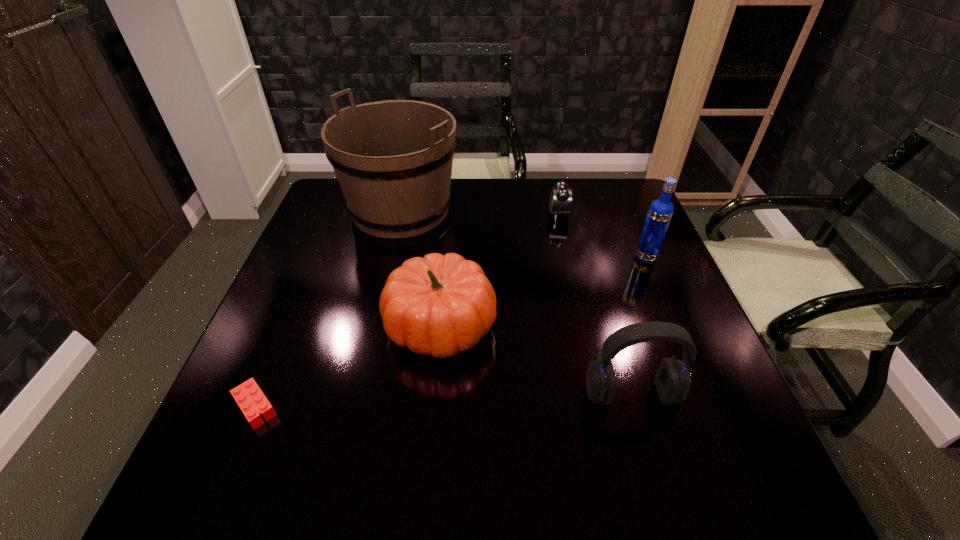
This screenshot has height=540, width=960. In order to click on free point located on the headband of the headset in this screenshot , I will do 657,483.

At what (x,y) coordinates should I click in order to perform the action: click on vacant area located 0.080m on the left of the pumpkin. Please return your answer as a coordinate pair (x, y). This screenshot has height=540, width=960. Looking at the image, I should click on (349, 326).

The width and height of the screenshot is (960, 540). Identify the location of vacant area situated 0.060m on the front side of the fifth tallest object. (529, 214).

I want to click on vacant space situated on the front side of the fifth tallest object, so click(519, 214).

This screenshot has width=960, height=540. In order to click on free spot located on the front side of the fifth tallest object in this screenshot , I will do `click(424, 214)`.

This screenshot has width=960, height=540. I want to click on vacant point located 0.370m on the right of the Lego, so click(x=473, y=407).

Image resolution: width=960 pixels, height=540 pixels. I want to click on bucket that is at the far edge, so click(393, 159).

This screenshot has height=540, width=960. In order to click on alarm clock positioned at the far edge in this screenshot , I will do `click(561, 195)`.

Identify the location of bucket that is at the left edge. (393, 159).

This screenshot has height=540, width=960. I want to click on Lego that is positioned at the left edge, so click(x=249, y=397).